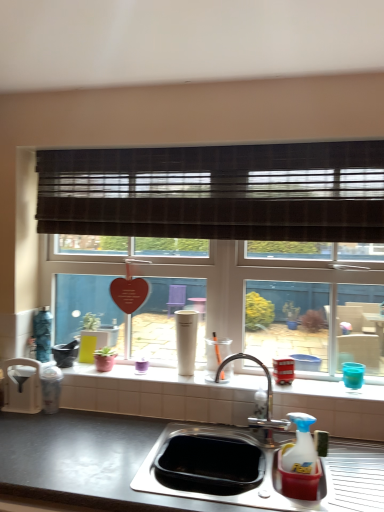
The width and height of the screenshot is (384, 512). In order to click on vacant space in front of blue plastic cup at right, which ranks as the 1th appliance in right-to-left order in this screenshot , I will do `click(364, 392)`.